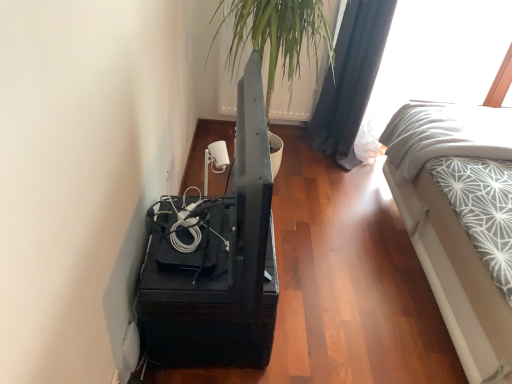
Question: Does white textured fabric at right have a smaller size compared to green leafy plant at upper center?

Choices:
 (A) no
 (B) yes

Answer: (B)

Question: From the image's perspective, is white textured fabric at right over green leafy plant at upper center?

Choices:
 (A) yes
 (B) no

Answer: (B)

Question: From a real-world perspective, does white textured fabric at right sit lower than green leafy plant at upper center?

Choices:
 (A) no
 (B) yes

Answer: (B)

Question: Are white textured fabric at right and green leafy plant at upper center making contact?

Choices:
 (A) no
 (B) yes

Answer: (A)

Question: Is green leafy plant at upper center at the back of white textured fabric at right?

Choices:
 (A) no
 (B) yes

Answer: (A)

Question: Looking at their shapes, would you say transparent glass window at upper right is wider or thinner than green leafy plant at upper center?

Choices:
 (A) thin
 (B) wide

Answer: (A)

Question: From the image's perspective, is transparent glass window at upper right above or below green leafy plant at upper center?

Choices:
 (A) below
 (B) above

Answer: (B)

Question: From their relative heights in the image, would you say transparent glass window at upper right is taller or shorter than green leafy plant at upper center?

Choices:
 (A) tall
 (B) short

Answer: (B)

Question: From a real-world perspective, is transparent glass window at upper right positioned above or below green leafy plant at upper center?

Choices:
 (A) above
 (B) below

Answer: (B)

Question: Does point (151, 311) appear closer or farther from the camera than point (439, 153)?

Choices:
 (A) closer
 (B) farther

Answer: (A)

Question: From their relative heights in the image, would you say black matte tv stand at lower left is taller or shorter than white textured fabric at right?

Choices:
 (A) tall
 (B) short

Answer: (A)

Question: Looking at the image, does black matte tv stand at lower left seem bigger or smaller compared to white textured fabric at right?

Choices:
 (A) small
 (B) big

Answer: (A)

Question: From a real-world perspective, is black matte tv stand at lower left positioned above or below white textured fabric at right?

Choices:
 (A) above
 (B) below

Answer: (B)

Question: Based on their positions, is black matte tv stand at lower left located to the left or right of transparent glass window at upper right?

Choices:
 (A) left
 (B) right

Answer: (A)

Question: From the image's perspective, relative to transparent glass window at upper right, is black matte tv stand at lower left above or below?

Choices:
 (A) below
 (B) above

Answer: (A)